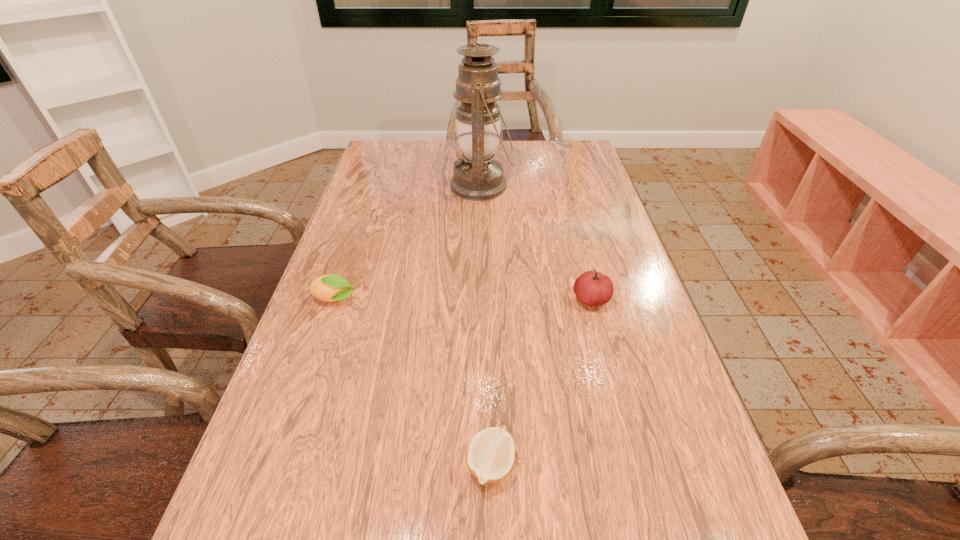
You are a GUI agent. You are given a task and a screenshot of the screen. Output one action in this format:
    pyautogui.click(x=<x>, y=<y>)
    Task: Click on the free space between the tallest object and the shorter lemon
    The width and height of the screenshot is (960, 540).
    Given the screenshot: What is the action you would take?
    pyautogui.click(x=486, y=325)

The width and height of the screenshot is (960, 540). Identify the location of vacant space in between the farthest object and the shorter lemon. (486, 325).

The image size is (960, 540). In order to click on free area in between the oil lamp and the leftmost object in this screenshot , I will do click(x=408, y=242).

Where is `vacant space that's between the oil lamp and the third shortest object`? This screenshot has width=960, height=540. vacant space that's between the oil lamp and the third shortest object is located at coordinates (537, 243).

This screenshot has height=540, width=960. What are the coordinates of `empty space between the tomato and the nearest object` in the screenshot? It's located at (540, 382).

The image size is (960, 540). In order to click on vacant area between the farthest object and the tomato in this screenshot , I will do `click(537, 243)`.

What are the coordinates of `vacant point located between the third tallest object and the rightmost object` in the screenshot? It's located at (463, 300).

Find the location of a particular element. Image resolution: width=960 pixels, height=540 pixels. free space between the farther lemon and the rightmost object is located at coordinates (463, 300).

At what (x,y) coordinates should I click in order to perform the action: click on the second closest object to the second tallest object. Please return your answer as a coordinate pair (x, y). Looking at the image, I should click on (478, 177).

At what (x,y) coordinates should I click in order to perform the action: click on object that is the second closest to the farther lemon. Please return your answer as a coordinate pair (x, y). Looking at the image, I should click on (491, 453).